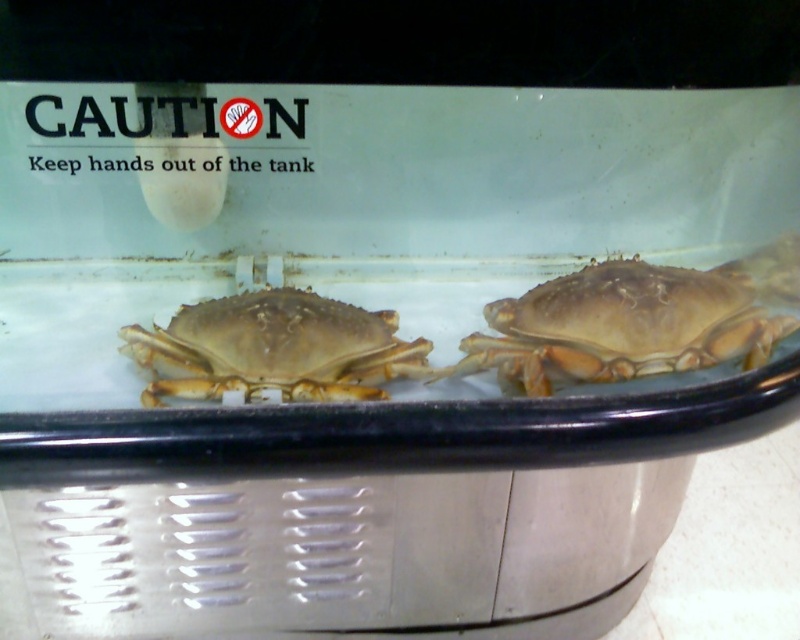
Question: Does shiny brown crab at right have a larger size compared to brown matte crab at center?

Choices:
 (A) yes
 (B) no

Answer: (A)

Question: Which point appears farthest from the camera in this image?

Choices:
 (A) (644, 280)
 (B) (258, 296)

Answer: (B)

Question: Is shiny brown crab at right bigger than brown matte crab at center?

Choices:
 (A) no
 (B) yes

Answer: (B)

Question: From the image, what is the correct spatial relationship of shiny brown crab at right in relation to brown matte crab at center?

Choices:
 (A) left
 (B) right

Answer: (B)